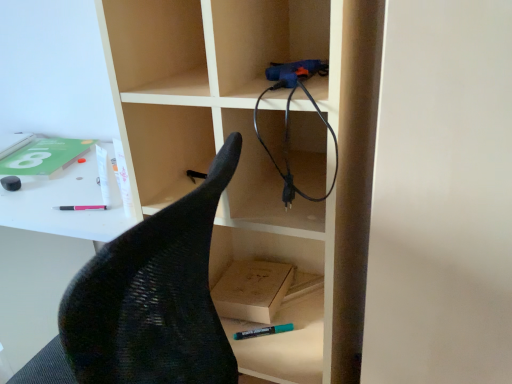
You are a GUI agent. You are given a task and a screenshot of the screen. Output one action in this format:
    pyautogui.click(x=<x>, y=<y>)
    Task: Click on the teal matte marker at lower center, which is the first stationery in bottom-to-top order
    The height and width of the screenshot is (384, 512).
    Given the screenshot: What is the action you would take?
    pyautogui.click(x=263, y=331)

Image resolution: width=512 pixels, height=384 pixels. I want to click on black rubber cable at upper right, so click(x=288, y=143).

Considering the points (19, 178) and (101, 320), which point is behind, point (19, 178) or point (101, 320)?

The point (19, 178) is farther from the camera.

In terms of height, does matte black eraser at left, which appears as the second stationery when viewed from the right, look taller or shorter compared to black mesh chair at left?

In the image, matte black eraser at left, which appears as the second stationery when viewed from the right, appears to be shorter than black mesh chair at left.

Is matte black eraser at left, which is the second stationery in front-to-back order, with black mesh chair at left?

They are not placed beside each other.

Considering the relative sizes of black rubber cable at upper right and matte black eraser at left, which appears as the second stationery when viewed from the right, in the image provided, is black rubber cable at upper right wider than matte black eraser at left, which appears as the second stationery when viewed from the right,?

Correct, the width of black rubber cable at upper right exceeds that of matte black eraser at left, which appears as the second stationery when viewed from the right.

Looking at this image, is black rubber cable at upper right turned away from matte black eraser at left, the first stationery in the top-to-bottom sequence?

No, black rubber cable at upper right is not facing the opposite direction of matte black eraser at left, the first stationery in the top-to-bottom sequence.

Is black rubber cable at upper right in front of or behind matte black eraser at left, which is the second stationery in front-to-back order, in the image?

black rubber cable at upper right is positioned closer to the viewer than matte black eraser at left, which is the second stationery in front-to-back order.

From the picture: Between black rubber cable at upper right and matte black eraser at left, the 1th stationery viewed from the left, which one has less height?

matte black eraser at left, the 1th stationery viewed from the left, is shorter.

Does point (246, 331) appear closer or farther from the camera than point (318, 301)?

Point (246, 331) is positioned closer to the camera compared to point (318, 301).

Does teal matte marker at lower center, the first stationery in the right-to-left sequence, lie behind wooden bookshelf at center?

Yes, it is.

At what (x,y) coordinates should I click in order to perform the action: click on the 1st stationery behind the wooden bookshelf at center. Please return your answer as a coordinate pair (x, y). The width and height of the screenshot is (512, 384). Looking at the image, I should click on (263, 331).

Is teal matte marker at lower center, which is the first stationery in bottom-to-top order, wider or thinner than wooden bookshelf at center?

teal matte marker at lower center, which is the first stationery in bottom-to-top order, is thinner than wooden bookshelf at center.

From the picture: Considering the sizes of black rubber cable at upper right and wooden bookshelf at center in the image, is black rubber cable at upper right bigger or smaller than wooden bookshelf at center?

black rubber cable at upper right is smaller than wooden bookshelf at center.

From the image's perspective, is black rubber cable at upper right located above or below wooden bookshelf at center?

Based on their image positions, black rubber cable at upper right is located above wooden bookshelf at center.

In the image, there is a wooden bookshelf at center. Where is `cable above it (from the image's perspective)`? The width and height of the screenshot is (512, 384). cable above it (from the image's perspective) is located at coordinates (288, 143).

Based on the photo, does black mesh chair at left have a smaller size compared to light brown cardboard box at lower center?

No, black mesh chair at left is not smaller than light brown cardboard box at lower center.

From the image's perspective, is black mesh chair at left below light brown cardboard box at lower center?

Indeed, from the image's perspective, black mesh chair at left is shown beneath light brown cardboard box at lower center.

From a real-world perspective, between black mesh chair at left and light brown cardboard box at lower center, who is vertically higher?

light brown cardboard box at lower center is physically above.

Measure the distance from black mesh chair at left to light brown cardboard box at lower center.

black mesh chair at left and light brown cardboard box at lower center are 13.94 inches apart from each other.

From a real-world perspective, is wooden bookshelf at center positioned above or below light brown cardboard box at lower center?

From a real-world perspective, wooden bookshelf at center is physically above light brown cardboard box at lower center.

Is wooden bookshelf at center positioned far away from light brown cardboard box at lower center?

That's not correct — wooden bookshelf at center is a little close to light brown cardboard box at lower center.

Find the location of `bookshelf that appears in front of the light brown cardboard box at lower center`. bookshelf that appears in front of the light brown cardboard box at lower center is located at coordinates (223, 143).

Considering the positions of point (340, 55) and point (222, 305), is point (340, 55) closer or farther from the camera than point (222, 305)?

Point (340, 55) appears to be closer to the viewer than point (222, 305).

The width and height of the screenshot is (512, 384). In order to click on armchair that appears on the left of wooden bookshelf at center in this screenshot , I will do `click(146, 302)`.

Which object is thinner, wooden bookshelf at center or black mesh chair at left?

wooden bookshelf at center.

Which is in front, wooden bookshelf at center or black mesh chair at left?

wooden bookshelf at center.

Can we say wooden bookshelf at center lies outside black mesh chair at left?

Yes, wooden bookshelf at center is located beyond the bounds of black mesh chair at left.

Which stationery is the 2nd one when counting from the back of the black mesh chair at left? Please provide its 2D coordinates.

[(11, 183)]

From the black rubber cable at upper right, count the 2nd stationery to the left and point to it. Please provide its 2D coordinates.

[(11, 183)]

Looking at the image, which one is located further to black mesh chair at left, wooden bookshelf at center or black rubber cable at upper right?

Among the two, black rubber cable at upper right is located further to black mesh chair at left.

Considering their positions, is black mesh chair at left positioned closer to matte black eraser at left, which is the 1th stationery from back to front, than wooden bookshelf at center?

wooden bookshelf at center is positioned closer to the anchor matte black eraser at left, which is the 1th stationery from back to front.

Considering their positions, is matte black eraser at left, the first stationery in the top-to-bottom sequence, positioned further to teal matte marker at lower center, the second stationery from the left, than black mesh chair at left?

matte black eraser at left, the first stationery in the top-to-bottom sequence.

Considering their positions, is teal matte marker at lower center, the 2th stationery in the top-to-bottom sequence, positioned further to black mesh chair at left than light brown cardboard box at lower center?

Based on the image, teal matte marker at lower center, the 2th stationery in the top-to-bottom sequence, appears to be further to black mesh chair at left.

From the image, which object appears to be nearer to wooden bookshelf at center, black rubber cable at upper right or light brown cardboard box at lower center?

Among the two, black rubber cable at upper right is located nearer to wooden bookshelf at center.

When comparing their distances from black mesh chair at left, does matte black eraser at left, which ranks as the second stationery in bottom-to-top order, or light brown cardboard box at lower center seem further?

matte black eraser at left, which ranks as the second stationery in bottom-to-top order, is further to black mesh chair at left.

Which object lies further to the anchor point black mesh chair at left, teal matte marker at lower center, the 2th stationery in the top-to-bottom sequence, or matte black eraser at left, the first stationery in the top-to-bottom sequence?

matte black eraser at left, the first stationery in the top-to-bottom sequence, is further to black mesh chair at left.

When comparing their distances from teal matte marker at lower center, the first stationery in the right-to-left sequence, does light brown cardboard box at lower center or matte black eraser at left, the first stationery in the top-to-bottom sequence, seem closer?

light brown cardboard box at lower center is positioned closer to the anchor teal matte marker at lower center, the first stationery in the right-to-left sequence.

Where is `stationery between black rubber cable at upper right and light brown cardboard box at lower center along the z-axis`? Image resolution: width=512 pixels, height=384 pixels. stationery between black rubber cable at upper right and light brown cardboard box at lower center along the z-axis is located at coordinates (263, 331).

You are a GUI agent. You are given a task and a screenshot of the screen. Output one action in this format:
    pyautogui.click(x=<x>, y=<y>)
    Task: Click on the stationery between matte black eraser at left, which is the 1th stationery from back to front, and wooden bookshelf at center, in the horizontal direction
    This screenshot has height=384, width=512.
    Given the screenshot: What is the action you would take?
    pyautogui.click(x=263, y=331)

Identify the location of armchair between matte black eraser at left, the 1th stationery viewed from the left, and teal matte marker at lower center, the first stationery in the right-to-left sequence. This screenshot has width=512, height=384. (146, 302).

This screenshot has height=384, width=512. I want to click on cardboard box between black mesh chair at left and teal matte marker at lower center, marked as the 1th stationery in a front-to-back arrangement, so click(252, 290).